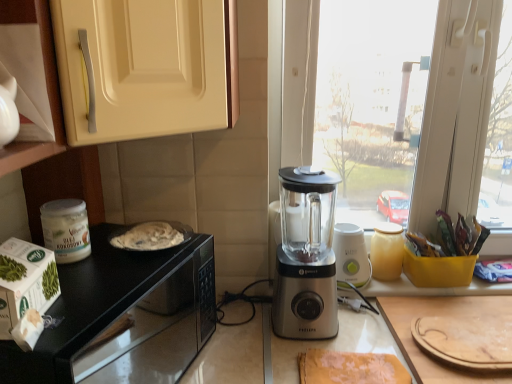
Question: Is satin silver blender at center, which is the 1th blender from front to back, beside black glossy microwave at lower left?

Choices:
 (A) no
 (B) yes

Answer: (A)

Question: Is black glossy microwave at lower left located within satin silver blender at center, marked as the 1th blender in a left-to-right arrangement?

Choices:
 (A) yes
 (B) no

Answer: (B)

Question: From a real-world perspective, is satin silver blender at center, acting as the second blender starting from the back, beneath black glossy microwave at lower left?

Choices:
 (A) no
 (B) yes

Answer: (A)

Question: Is satin silver blender at center, the second blender viewed from the right, facing towards black glossy microwave at lower left?

Choices:
 (A) no
 (B) yes

Answer: (A)

Question: Does satin silver blender at center, marked as the 1th blender in a left-to-right arrangement, have a larger size compared to black glossy microwave at lower left?

Choices:
 (A) no
 (B) yes

Answer: (A)

Question: Is satin silver blender at center, the second blender viewed from the right, thinner than black glossy microwave at lower left?

Choices:
 (A) no
 (B) yes

Answer: (B)

Question: Does matte cream cabinet at upper left, which is the 1th cabinetry in right-to-left order, lie in front of white cardboard box at left?

Choices:
 (A) no
 (B) yes

Answer: (B)

Question: Are matte cream cabinet at upper left, marked as the second cabinetry in a front-to-back arrangement, and white cardboard box at left far apart?

Choices:
 (A) yes
 (B) no

Answer: (B)

Question: Is matte cream cabinet at upper left, which is the 1th cabinetry in right-to-left order, oriented away from white cardboard box at left?

Choices:
 (A) yes
 (B) no

Answer: (B)

Question: From the image's perspective, would you say matte cream cabinet at upper left, arranged as the first cabinetry when viewed from the back, is shown under white cardboard box at left?

Choices:
 (A) no
 (B) yes

Answer: (A)

Question: Does matte cream cabinet at upper left, which is the 1th cabinetry in right-to-left order, have a greater width compared to white cardboard box at left?

Choices:
 (A) yes
 (B) no

Answer: (A)

Question: Considering the relative sizes of matte cream cabinet at upper left, positioned as the 2th cabinetry in left-to-right order, and white cardboard box at left in the image provided, is matte cream cabinet at upper left, positioned as the 2th cabinetry in left-to-right order, shorter than white cardboard box at left?

Choices:
 (A) no
 (B) yes

Answer: (A)

Question: Can you confirm if satin silver blender at center, which is the 1th blender from front to back, is bigger than white cardboard box at left?

Choices:
 (A) yes
 (B) no

Answer: (A)